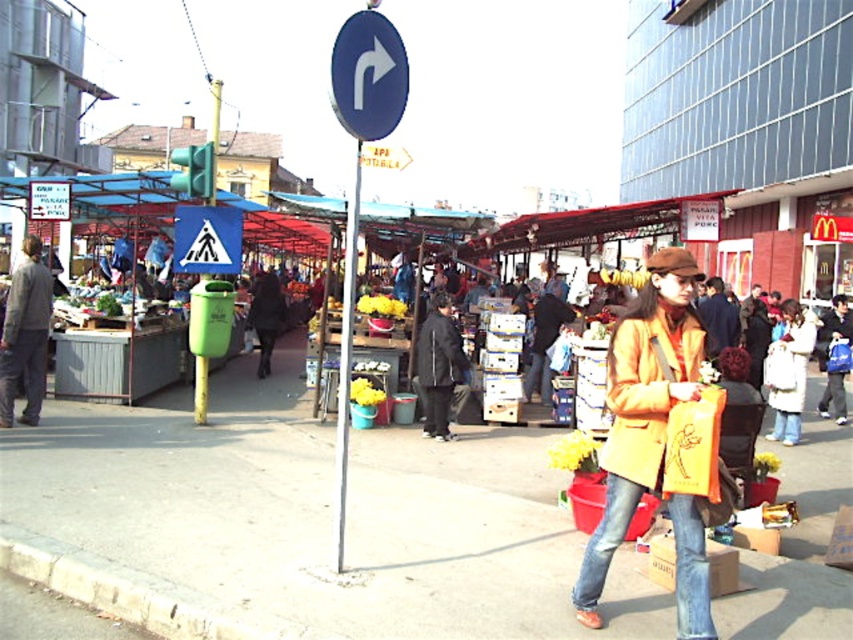
Is matte gray suit at left below brown leather jacket at center?

Yes.

Which is above, matte gray suit at left or brown leather jacket at center?

Positioned higher is brown leather jacket at center.

Describe the element at coordinates (25, 336) in the screenshot. This screenshot has height=640, width=853. I see `matte gray suit at left` at that location.

Image resolution: width=853 pixels, height=640 pixels. I want to click on matte gray suit at left, so click(x=25, y=336).

In the scene shown: Can you confirm if matte yellow coat at center is positioned to the right of blue metallic sign at center?

Correct, you'll find matte yellow coat at center to the right of blue metallic sign at center.

Is matte yellow coat at center below blue metallic sign at center?

Indeed, matte yellow coat at center is positioned under blue metallic sign at center.

Is point (627, 324) positioned before point (355, 140)?

Yes, point (627, 324) is closer to viewer.

Identify the location of matte yellow coat at center. The image size is (853, 640). (648, 387).

Does matte yellow trench coat at center appear under brown leather jacket at center?

Yes, matte yellow trench coat at center is below brown leather jacket at center.

Can you confirm if matte yellow trench coat at center is positioned to the left of brown leather jacket at center?

Yes, matte yellow trench coat at center is to the left of brown leather jacket at center.

You are a GUI agent. You are given a task and a screenshot of the screen. Output one action in this format:
    pyautogui.click(x=<x>, y=<y>)
    Task: Click on the matte yellow trench coat at center
    The image size is (853, 640).
    Given the screenshot: What is the action you would take?
    pyautogui.click(x=641, y=404)